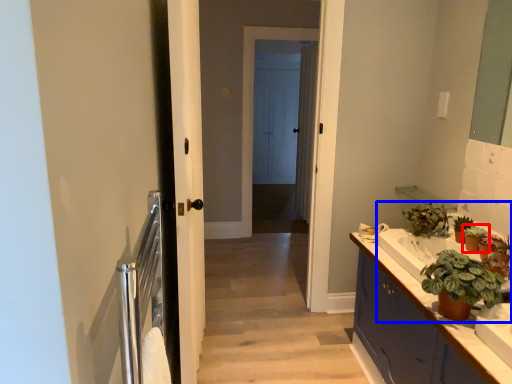
Question: Which object is closer to the camera taking this photo, houseplant (highlighted by a red box) or sink (highlighted by a blue box)?

Choices:
 (A) houseplant
 (B) sink

Answer: (B)